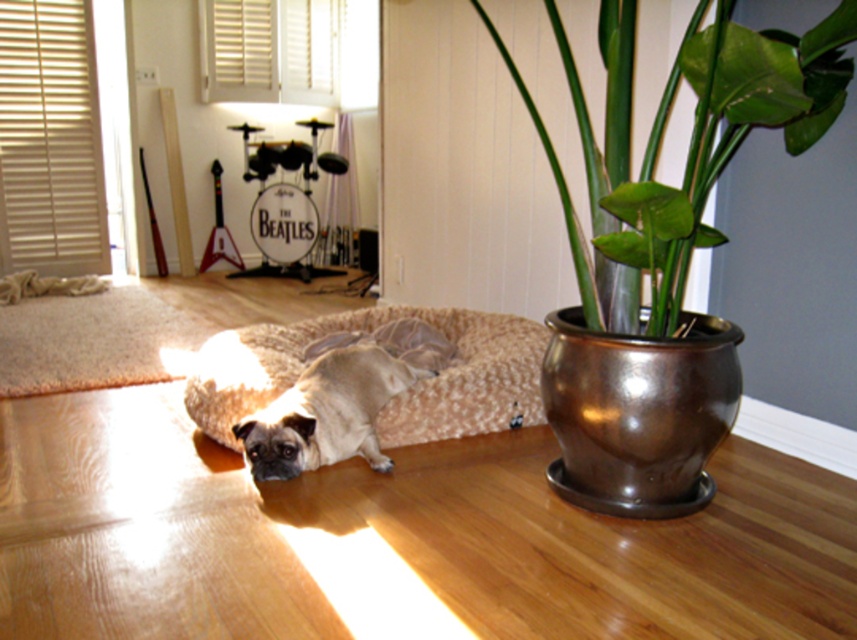
Question: Can you confirm if green glossy pot at right is smaller than beige plush dog bed at center?

Choices:
 (A) yes
 (B) no

Answer: (A)

Question: Considering the real-world distances, which object is farthest from the beige plush dog bed at center?

Choices:
 (A) green glossy pot at right
 (B) fuzzy beige dog at center

Answer: (A)

Question: Which point is closer to the camera?

Choices:
 (A) fuzzy beige dog at center
 (B) green glossy pot at right
 (C) beige plush dog bed at center

Answer: (B)

Question: Can you confirm if green glossy pot at right is wider than beige plush dog bed at center?

Choices:
 (A) no
 (B) yes

Answer: (A)

Question: Can you confirm if beige plush dog bed at center is positioned to the left of fuzzy beige dog at center?

Choices:
 (A) yes
 (B) no

Answer: (B)

Question: Which of the following is the closest to the observer?

Choices:
 (A) fuzzy beige dog at center
 (B) beige plush dog bed at center

Answer: (A)